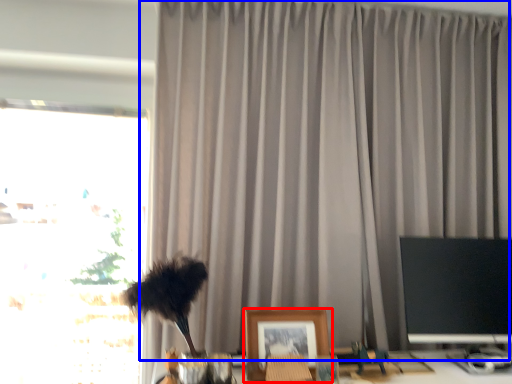
Question: Which object is further to the camera taking this photo, picture frame (highlighted by a red box) or curtain (highlighted by a blue box)?

Choices:
 (A) picture frame
 (B) curtain

Answer: (B)